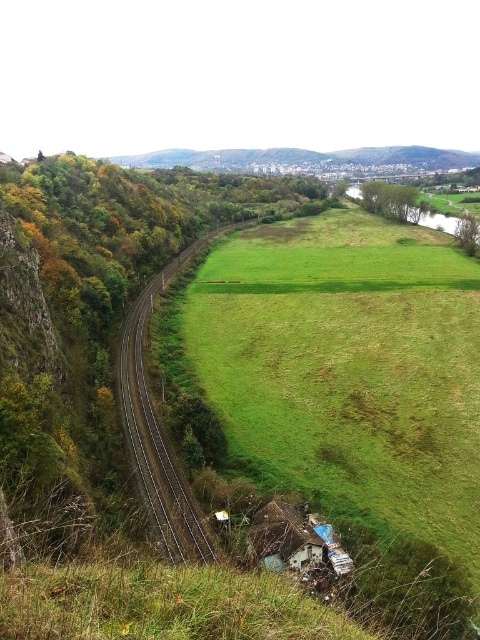
Question: Which object appears farthest from the camera in this image?

Choices:
 (A) green grassy field at center
 (B) metallic tracks at center

Answer: (B)

Question: Is green grassy field at center wider than metallic tracks at center?

Choices:
 (A) no
 (B) yes

Answer: (B)

Question: Can you confirm if green grassy field at center is wider than metallic tracks at center?

Choices:
 (A) yes
 (B) no

Answer: (A)

Question: Is green grassy field at center positioned at the back of metallic tracks at center?

Choices:
 (A) yes
 (B) no

Answer: (B)